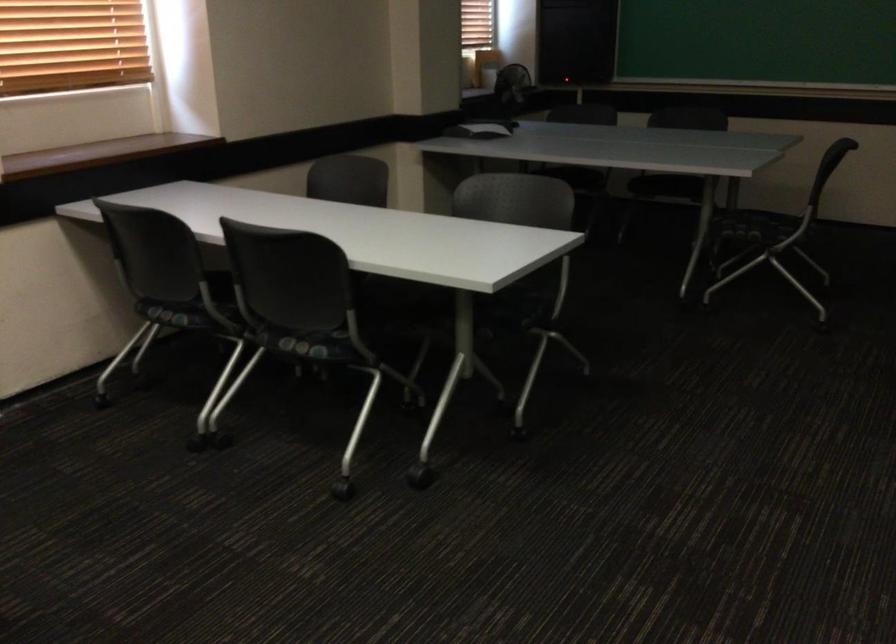
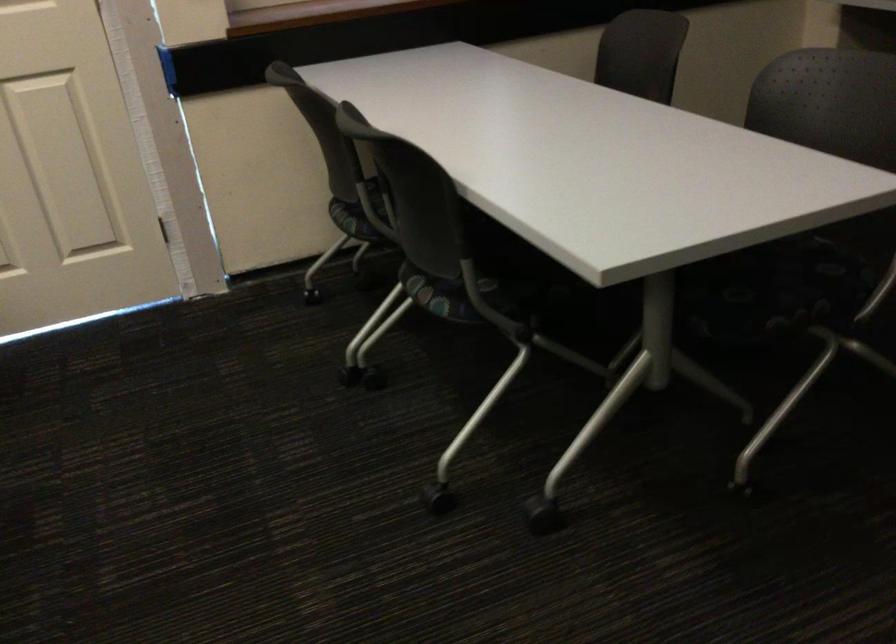
In the second image, find the point that corresponds to pixel 314 346 in the first image.

(442, 295)